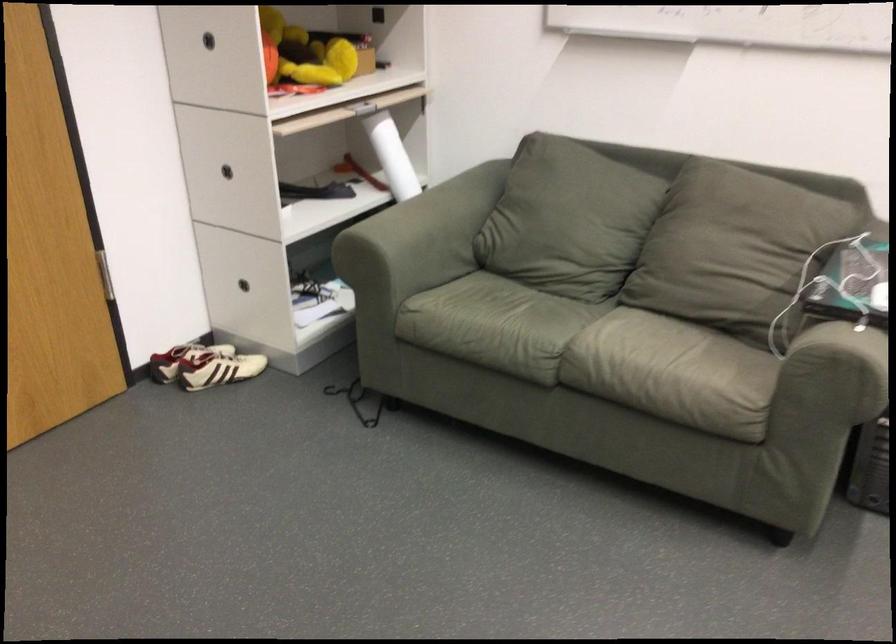
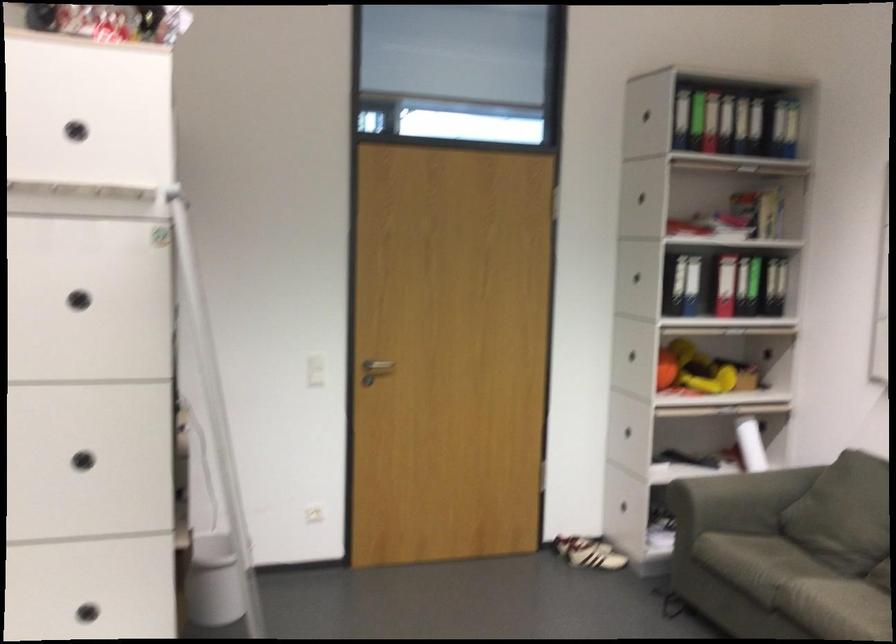
In the second image, find the point that corresponds to point 228,362 in the first image.

(583, 552)